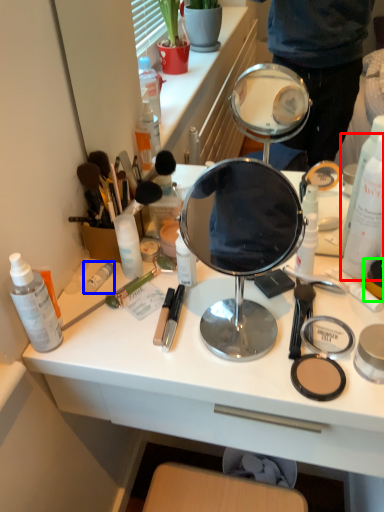
Question: Which object is the farthest from bottle (highlighted by a red box)? Choose among these: toiletry (highlighted by a blue box) or toiletry (highlighted by a green box).

Choices:
 (A) toiletry
 (B) toiletry

Answer: (A)